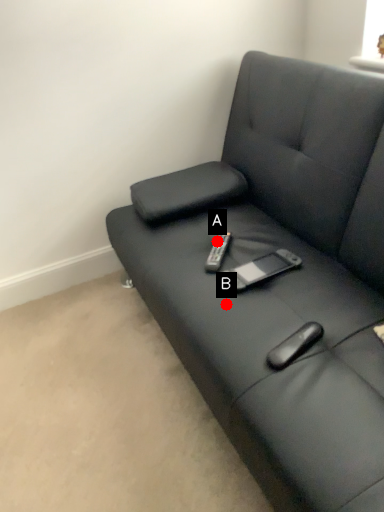
Question: Two points are circled on the image, labeled by A and B beside each circle. Which of the following is the farthest from the observer?

Choices:
 (A) A is further
 (B) B is further

Answer: (A)